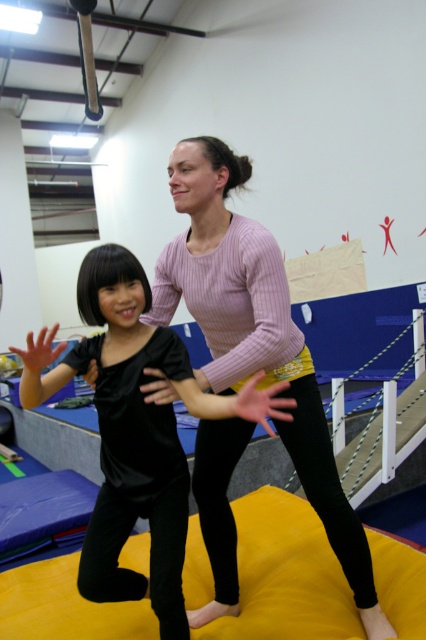
Question: Which point is farther from the camera taking this photo?

Choices:
 (A) (213, 381)
 (B) (184, 392)

Answer: (A)

Question: Does pink ribbed sweater at center have a greater width compared to black velvet shirt at center?

Choices:
 (A) yes
 (B) no

Answer: (B)

Question: Is pink ribbed sweater at center further to the viewer compared to black velvet shirt at center?

Choices:
 (A) no
 (B) yes

Answer: (B)

Question: Which object is farther from the camera taking this photo?

Choices:
 (A) pink ribbed sweater at center
 (B) black velvet shirt at center

Answer: (A)

Question: Which of the following is the farthest from the observer?

Choices:
 (A) pink ribbed sweater at center
 (B) black velvet shirt at center

Answer: (A)

Question: Is pink ribbed sweater at center positioned at the back of black velvet shirt at center?

Choices:
 (A) no
 (B) yes

Answer: (B)